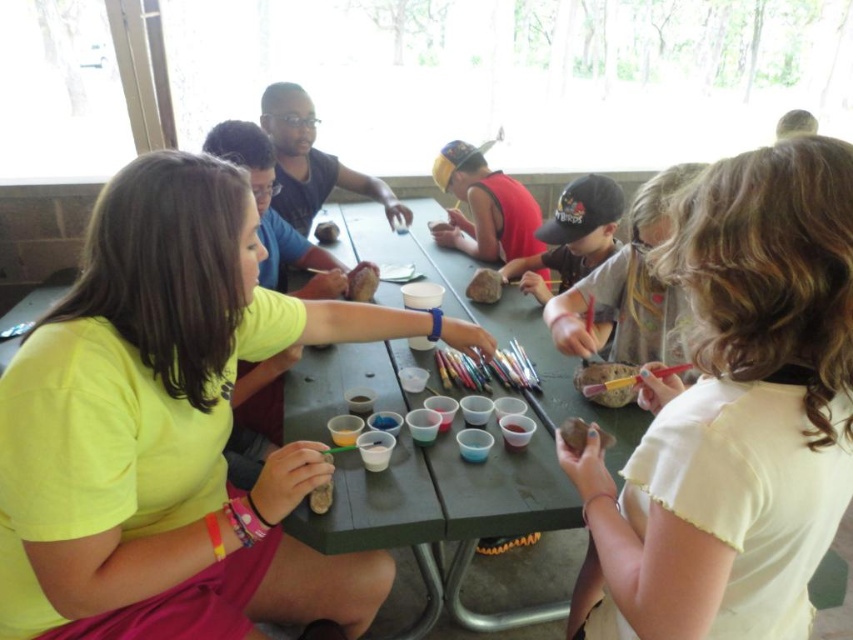
You are a photographer trying to capture a closeup of the matte brown rock at lower center without including the matte black shirt at center in the frame. Based on their positions, is this possible?

The matte black shirt at center might be wider than the matte brown rock at lower center, so it may block the view. To avoid including the matte black shirt at center, you might need to adjust your angle or move closer to the matte brown rock at lower center.

You are a teacher organizing an art activity for children. You have two rocks, the matte brown rock at lower center and the matte gray rock at center. Which rock should you choose if you need a larger rock for a project that requires more surface area?

The matte gray rock at center is larger than the matte brown rock at lower center, so you should choose the matte gray rock at center for the project requiring more surface area.